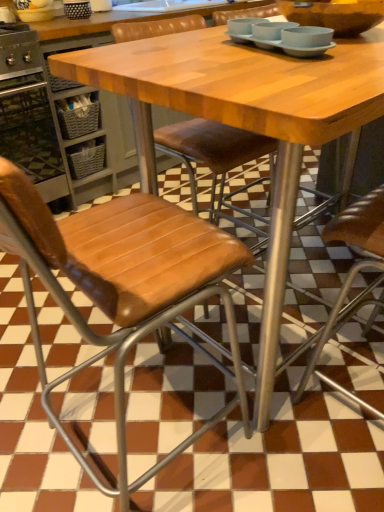
Identify the location of free region under wooden table at center (from a real-world perspective). This screenshot has height=512, width=384. click(x=173, y=461).